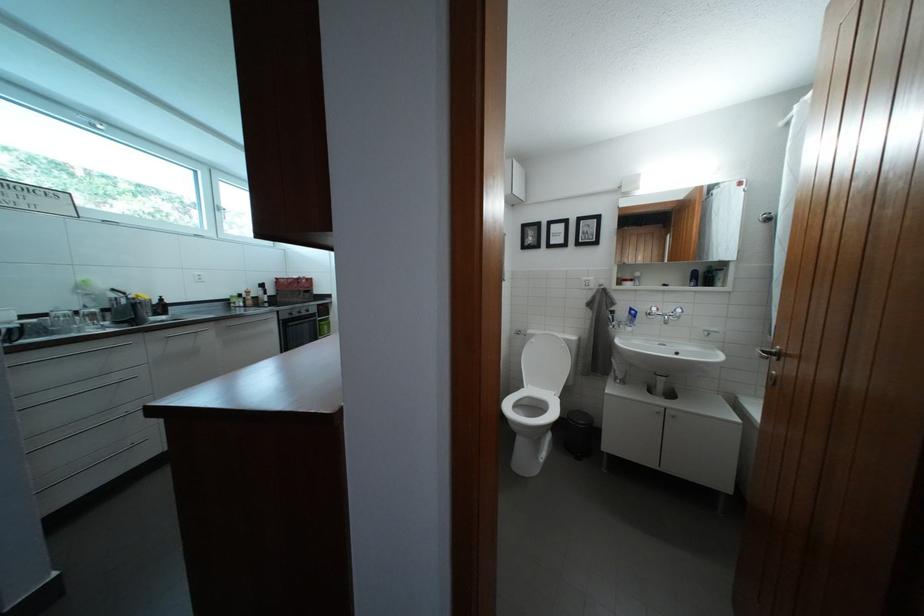
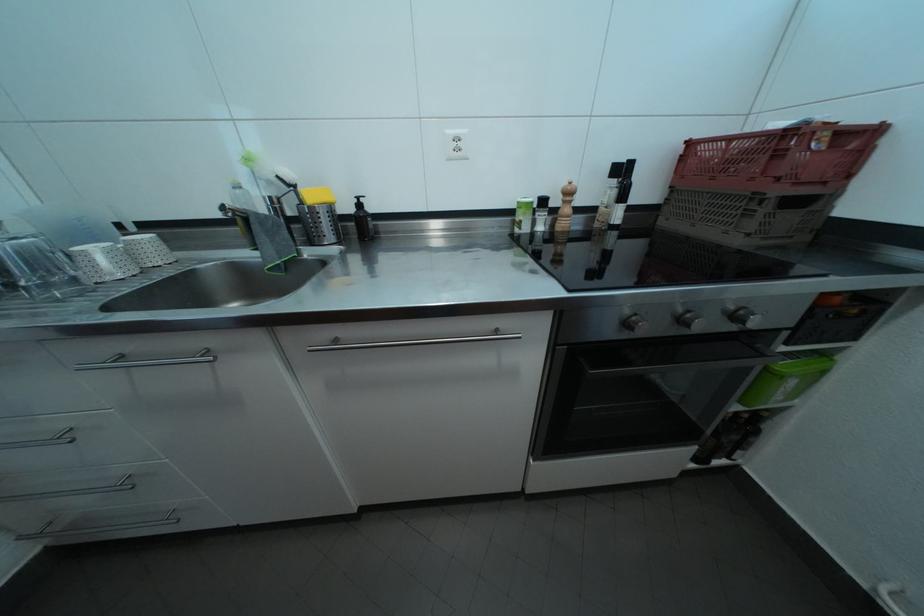
The point at (253, 301) is marked in the first image. Where is the corresponding point in the second image?

(564, 208)